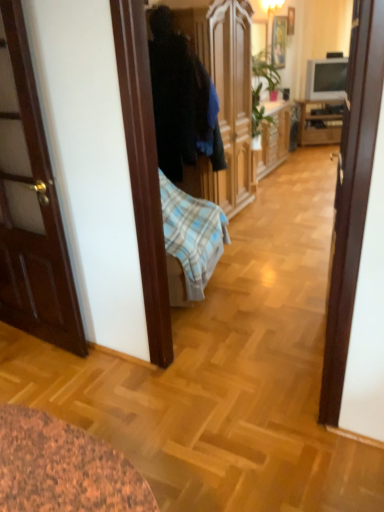
The height and width of the screenshot is (512, 384). Identify the location of wooden cabinet at right. (320, 122).

The width and height of the screenshot is (384, 512). What do you see at coordinates (291, 21) in the screenshot?
I see `wooden picture frame at upper center, the 2th picture frame from the left` at bounding box center [291, 21].

In order to face wooden picture frame at upper center, the 1th picture frame viewed from the left, should I rotate leftwards or rightwards?

Turn right approximately 11.521 degrees to face it.

Describe the element at coordinates (272, 5) in the screenshot. I see `matte white lampshade at upper center` at that location.

What is the approximate height of matte gray tv at upper right?

matte gray tv at upper right is 23.81 inches tall.

The width and height of the screenshot is (384, 512). What are the coordinates of `wooden cabinet at right` in the screenshot? It's located at (320, 122).

Considering the sizes of objects matte white lampshade at upper center and wooden picture frame at upper center, the 2th picture frame from the left, in the image provided, who is shorter, matte white lampshade at upper center or wooden picture frame at upper center, the 2th picture frame from the left,?

With less height is matte white lampshade at upper center.

Which of these two, matte white lampshade at upper center or wooden picture frame at upper center, the 2th picture frame from the left, is smaller?

wooden picture frame at upper center, the 2th picture frame from the left, is smaller.

Between point (277, 2) and point (293, 15), which one is positioned behind?

Positioned behind is point (293, 15).

Between matte white lampshade at upper center and wooden cabinet at right, which one has smaller width?

With smaller width is matte white lampshade at upper center.

Can you confirm if matte white lampshade at upper center is bigger than wooden cabinet at right?

Actually, matte white lampshade at upper center might be smaller than wooden cabinet at right.

Which of these two, matte white lampshade at upper center or wooden cabinet at right, stands taller?

wooden cabinet at right is taller.

Find the location of a particular element. The height and width of the screenshot is (512, 384). lamp lying in front of the wooden cabinet at right is located at coordinates (272, 5).

From a real-world perspective, between matte gray tv at upper right and wooden cabinet at right, who is vertically higher?

matte gray tv at upper right, from a real-world perspective.

Locate an element on the screen. The height and width of the screenshot is (512, 384). television lying above the wooden cabinet at right (from the image's perspective) is located at coordinates (326, 79).

Are matte gray tv at upper right and wooden cabinet at right making contact?

matte gray tv at upper right and wooden cabinet at right are not in contact.

Who is bigger, matte gray tv at upper right or wooden cabinet at right?

wooden cabinet at right is bigger.

In the scene shown: Considering the positions of objects wooden cabinet at right and matte white lampshade at upper center in the image provided, who is more to the left, wooden cabinet at right or matte white lampshade at upper center?

Positioned to the left is matte white lampshade at upper center.

Does wooden cabinet at right come behind matte white lampshade at upper center?

Yes, wooden cabinet at right is behind matte white lampshade at upper center.

From the image's perspective, is wooden cabinet at right over matte white lampshade at upper center?

Actually, wooden cabinet at right appears below matte white lampshade at upper center in the image.

Which point is more forward, (319, 100) or (268, 11)?

Positioned in front is point (268, 11).

The height and width of the screenshot is (512, 384). I want to click on the 1st picture frame above when counting from the wooden cabinet at right (from the image's perspective), so click(x=279, y=41).

Can wooden cabinet at right be found inside wooden picture frame at upper center, the 1th picture frame viewed from the left?

No.

Which object is wider, matte gray tv at upper right or dark fabric coat at center?

Wider between the two is dark fabric coat at center.

Which object is more forward, matte gray tv at upper right or dark fabric coat at center?

dark fabric coat at center is closer to the camera.

Considering the sizes of objects matte gray tv at upper right and dark fabric coat at center in the image provided, who is smaller, matte gray tv at upper right or dark fabric coat at center?

Smaller between the two is matte gray tv at upper right.

Which is farther from the camera, (331, 89) or (159, 160)?

The point (331, 89) is farther from the camera.

Is wooden picture frame at upper center, which is counted as the 1th picture frame, starting from the right, closer to camera compared to wooden cabinet at right?

Yes, the depth of wooden picture frame at upper center, which is counted as the 1th picture frame, starting from the right, is less than that of wooden cabinet at right.

Looking at this image, visually, is wooden picture frame at upper center, the 2th picture frame from the left, positioned to the left or to the right of wooden cabinet at right?

Clearly, wooden picture frame at upper center, the 2th picture frame from the left, is on the left of wooden cabinet at right in the image.

From the image's perspective, does wooden picture frame at upper center, the 2th picture frame from the left, appear lower than wooden cabinet at right?

→ No, from the image's perspective, wooden picture frame at upper center, the 2th picture frame from the left, is not below wooden cabinet at right.

Is wooden picture frame at upper center, which is counted as the 1th picture frame, starting from the right, aimed at wooden cabinet at right?

No, wooden picture frame at upper center, which is counted as the 1th picture frame, starting from the right, is not turned towards wooden cabinet at right.

There is a matte white lampshade at upper center. At what (x,y) coordinates should I click in order to perform the action: click on the 1st picture frame below it (from a real-world perspective). Please return your answer as a coordinate pair (x, y). The height and width of the screenshot is (512, 384). Looking at the image, I should click on (291, 21).

Image resolution: width=384 pixels, height=512 pixels. Find the location of `lamp in front of the wooden cabinet at right`. lamp in front of the wooden cabinet at right is located at coordinates (272, 5).

Estimate the real-world distances between objects in this image. Which object is closer to wooden cabinet at right, dark fabric coat at center or matte white lampshade at upper center?

Among the two, matte white lampshade at upper center is located nearer to wooden cabinet at right.

Looking at this image, estimate the real-world distances between objects in this image. Which object is closer to wooden picture frame at upper center, which is counted as the 1th picture frame, starting from the right, wooden cabinet at right or wooden picture frame at upper center, which ranks as the second picture frame in right-to-left order?

wooden picture frame at upper center, which ranks as the second picture frame in right-to-left order.

Which object lies nearer to the anchor point wooden picture frame at upper center, which is counted as the 1th picture frame, starting from the right, matte white lampshade at upper center or wooden picture frame at upper center, which ranks as the second picture frame in right-to-left order?

Based on the image, wooden picture frame at upper center, which ranks as the second picture frame in right-to-left order, appears to be nearer to wooden picture frame at upper center, which is counted as the 1th picture frame, starting from the right.

Which object lies nearer to the anchor point dark fabric coat at center, matte white lampshade at upper center or wooden picture frame at upper center, which is counted as the 1th picture frame, starting from the right?

matte white lampshade at upper center lies closer to dark fabric coat at center than the other object.

Based on their spatial positions, is matte white lampshade at upper center or wooden cabinet at right further from dark fabric coat at center?

Among the two, wooden cabinet at right is located further to dark fabric coat at center.

When comparing their distances from matte white lampshade at upper center, does wooden picture frame at upper center, which is counted as the 1th picture frame, starting from the right, or wooden cabinet at right seem closer?

Based on the image, wooden picture frame at upper center, which is counted as the 1th picture frame, starting from the right, appears to be nearer to matte white lampshade at upper center.

When comparing their distances from dark fabric coat at center, does wooden picture frame at upper center, which is counted as the 1th picture frame, starting from the right, or matte gray tv at upper right seem closer?

matte gray tv at upper right is closer to dark fabric coat at center.

From the image, which object appears to be nearer to matte gray tv at upper right, wooden picture frame at upper center, which ranks as the second picture frame in right-to-left order, or matte white lampshade at upper center?

wooden picture frame at upper center, which ranks as the second picture frame in right-to-left order, is closer to matte gray tv at upper right.

You are a GUI agent. You are given a task and a screenshot of the screen. Output one action in this format:
    pyautogui.click(x=<x>, y=<y>)
    Task: Click on the television between wooden picture frame at upper center, which ranks as the second picture frame in right-to-left order, and wooden cabinet at right from left to right
    
    Given the screenshot: What is the action you would take?
    pyautogui.click(x=326, y=79)

The image size is (384, 512). In order to click on television positioned between dark fabric coat at center and wooden cabinet at right from near to far in this screenshot , I will do `click(326, 79)`.

Image resolution: width=384 pixels, height=512 pixels. I want to click on picture frame between matte white lampshade at upper center and wooden picture frame at upper center, which is counted as the 1th picture frame, starting from the right, in the front-back direction, so click(279, 41).

Find the location of a particular element. This screenshot has height=512, width=384. television between wooden picture frame at upper center, the 2th picture frame from the left, and wooden cabinet at right vertically is located at coordinates (326, 79).